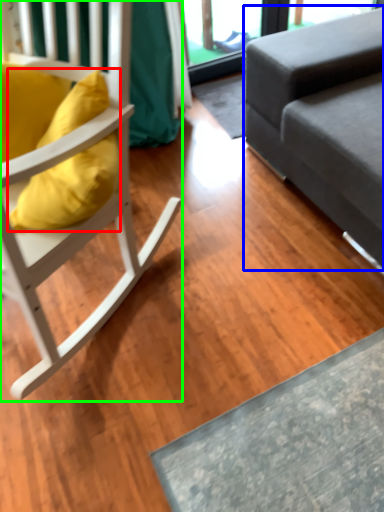
Question: Estimate the real-world distances between objects in this image. Which object is closer to pillow (highlighted by a red box), studio couch (highlighted by a blue box) or chair (highlighted by a green box)?

Choices:
 (A) studio couch
 (B) chair

Answer: (B)